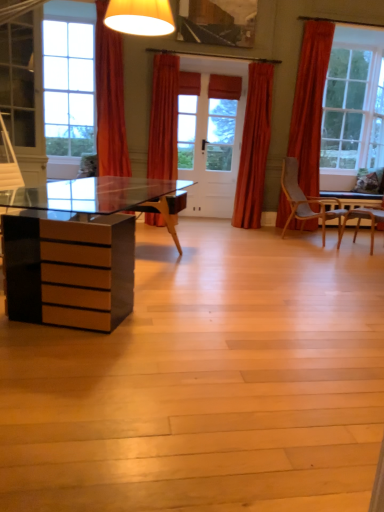
Question: Which direction should I rotate to face orange fabric curtain at upper center, the 1th curtain in the left-to-right sequence, — up or down?

Choices:
 (A) up
 (B) down

Answer: (A)

Question: From a real-world perspective, is orange fabric curtain at center, the second curtain from the right, below velvet orange curtain at center, the 1th curtain when ordered from right to left?

Choices:
 (A) no
 (B) yes

Answer: (A)

Question: Can we say orange fabric curtain at center, which ranks as the second curtain in left-to-right order, lies outside velvet orange curtain at center, which is counted as the third curtain, starting from the left?

Choices:
 (A) yes
 (B) no

Answer: (A)

Question: Can you confirm if orange fabric curtain at center, which ranks as the second curtain in left-to-right order, is bigger than velvet orange curtain at center, which is counted as the third curtain, starting from the left?

Choices:
 (A) yes
 (B) no

Answer: (A)

Question: Considering the relative sizes of orange fabric curtain at center, which ranks as the second curtain in left-to-right order, and velvet orange curtain at center, which is counted as the third curtain, starting from the left, in the image provided, is orange fabric curtain at center, which ranks as the second curtain in left-to-right order, taller than velvet orange curtain at center, which is counted as the third curtain, starting from the left,?

Choices:
 (A) no
 (B) yes

Answer: (A)

Question: Considering the relative positions of orange fabric curtain at center, which ranks as the second curtain in left-to-right order, and velvet orange curtain at center, the 1th curtain when ordered from right to left, in the image provided, is orange fabric curtain at center, which ranks as the second curtain in left-to-right order, to the right of velvet orange curtain at center, the 1th curtain when ordered from right to left, from the viewer's perspective?

Choices:
 (A) yes
 (B) no

Answer: (B)

Question: Does orange fabric curtain at center, which ranks as the second curtain in left-to-right order, turn towards velvet orange curtain at center, which is counted as the third curtain, starting from the left?

Choices:
 (A) yes
 (B) no

Answer: (B)

Question: Does velvet orange curtain at center, which is counted as the third curtain, starting from the left, have a larger size compared to orange fabric curtain at center, which ranks as the second curtain in left-to-right order?

Choices:
 (A) yes
 (B) no

Answer: (B)

Question: Is the depth of velvet orange curtain at center, which is counted as the third curtain, starting from the left, greater than that of orange fabric curtain at center, which ranks as the second curtain in left-to-right order?

Choices:
 (A) no
 (B) yes

Answer: (B)

Question: Is the position of velvet orange curtain at center, which is counted as the third curtain, starting from the left, less distant than that of orange fabric curtain at center, which ranks as the second curtain in left-to-right order?

Choices:
 (A) yes
 (B) no

Answer: (B)

Question: Is velvet orange curtain at center, which is counted as the third curtain, starting from the left, shorter than orange fabric curtain at center, the second curtain from the right?

Choices:
 (A) no
 (B) yes

Answer: (A)

Question: From a real-world perspective, is velvet orange curtain at center, which is counted as the third curtain, starting from the left, located higher than orange fabric curtain at center, the second curtain from the right?

Choices:
 (A) yes
 (B) no

Answer: (B)

Question: From the image's perspective, is velvet orange curtain at center, the 1th curtain when ordered from right to left, over orange fabric curtain at center, the second curtain from the right?

Choices:
 (A) yes
 (B) no

Answer: (B)

Question: Is the surface of orange fabric curtain at upper center, the 1th curtain in the left-to-right sequence, in direct contact with velvet orange curtain at center, which is counted as the third curtain, starting from the left?

Choices:
 (A) yes
 (B) no

Answer: (B)